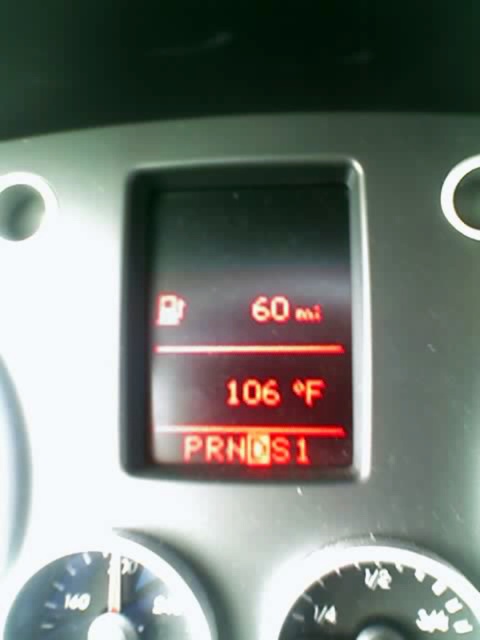
Is point (85, 566) farther from camera compared to point (364, 568)?

Yes.

Image resolution: width=480 pixels, height=640 pixels. What do you see at coordinates (108, 596) in the screenshot?
I see `black glass speedometer at lower left` at bounding box center [108, 596].

This screenshot has height=640, width=480. Find the location of `black glass speedometer at lower left`. black glass speedometer at lower left is located at coordinates (108, 596).